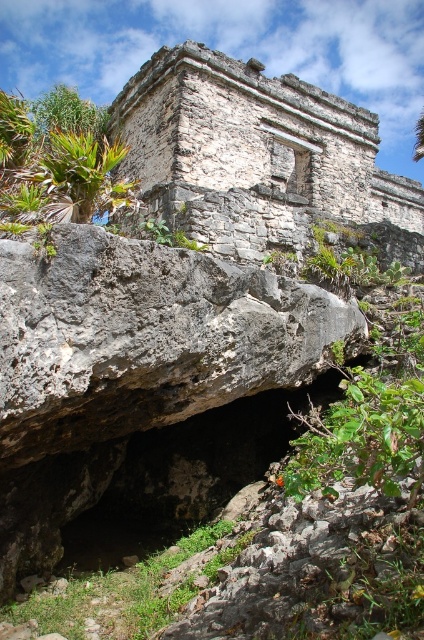
You are an archaeologist examining the ancient stone structure. You notice two points marked on your map at coordinates point (321, 140) and point (89, 205). Which point is closer to the observer standing in front of the structure?

Point (89, 205) is closer to the observer because it is in front of point (321, 140).

You are standing at the point marked by the coordinates point (254, 154) in the image. Describe what you see around you based on the scene description provided.

You are standing at point (254, 154), which marks weathered stone ruins at upper center. The ruins are part of an ancient stone structure with layered stone blocks, some weathered and aged, indicating significant antiquity. The structure has a rectangular base with a smaller section extending outward, possibly a window or decorative element, suggesting a design typical of Mesoamerican ruins. In the foreground, there is a large rugged rock formation partially obscuring the view of the structure, creating a